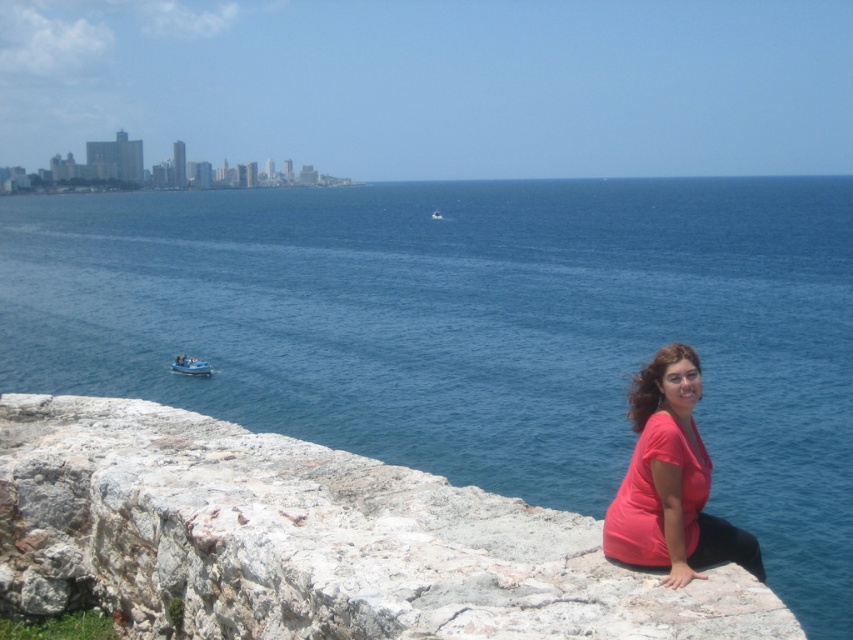
Is point (676, 496) closer to viewer compared to point (440, 216)?

That is True.

Locate an element on the screen. matte pink shirt at lower right is located at coordinates (670, 481).

Between point (664, 493) and point (436, 216), which one is positioned behind?

The point (436, 216) is behind.

In order to click on matte pink shirt at lower right in this screenshot , I will do `click(670, 481)`.

Which is more to the left, blue water at center or matte pink shirt at lower right?

matte pink shirt at lower right

The image size is (853, 640). What do you see at coordinates (476, 332) in the screenshot?
I see `blue water at center` at bounding box center [476, 332].

Identify the location of blue water at center. (476, 332).

Does point (190, 362) lie in front of point (433, 211)?

That is True.

Does smooth blue boat at left have a larger size compared to blue plastic boat at center?

No, smooth blue boat at left is not bigger than blue plastic boat at center.

I want to click on smooth blue boat at left, so click(190, 365).